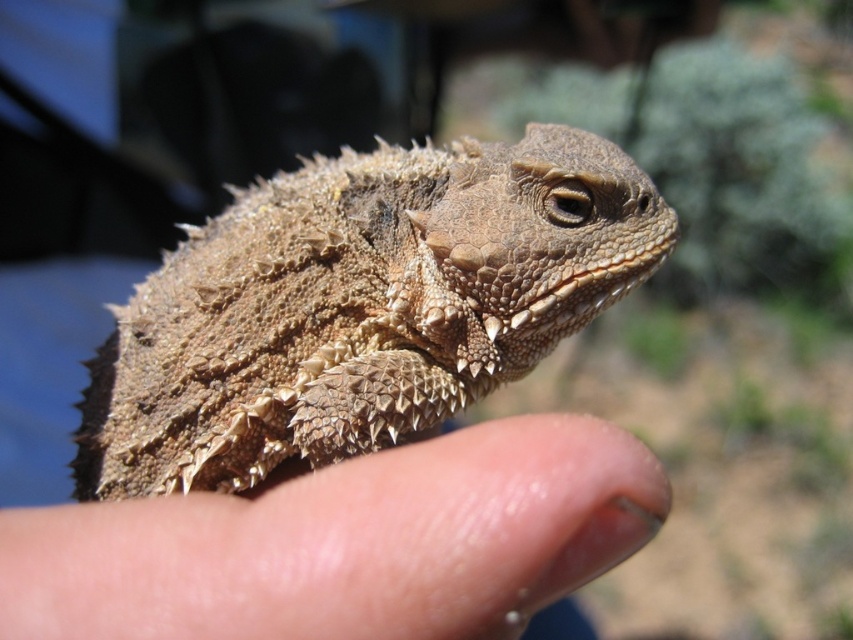
You are a photographer trying to focus on the horned lizard in the image. You notice two points in the scene at coordinates point (607,291) and point (624,458). Which point is closer to the camera?

Point (624,458) is closer to the camera than point (607,291) because the description states that point (607,291) is behind point (624,458).

From the picture: You are a biologist observing a closeup of a brown scaly lizard at center and dry skin at center. Which object is larger in size?

The brown scaly lizard at center is bigger than dry skin at center.

You are a photographer trying to focus on the brown scaly lizard at center and the dry skin at center in the image. Which object is closer to your camera lens?

The brown scaly lizard at center is closer to the camera lens than the dry skin at center because it is further to the viewer than the dry skin at center.